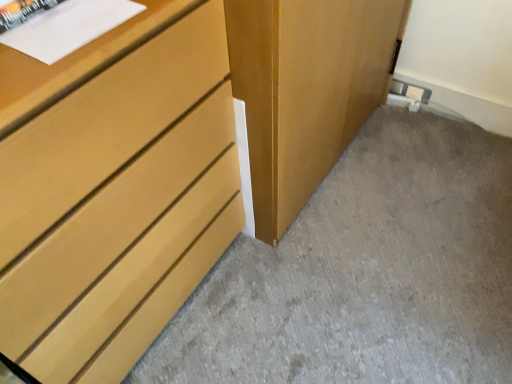
Consider the image. In order to face matte wood dresser at lower left, should I rotate leftwards or rightwards?

You should look right and rotate roughly 17.239 degrees.

Locate an element on the screen. matte wood dresser at lower left is located at coordinates (366, 273).

Describe the element at coordinates (366, 273) in the screenshot. This screenshot has height=384, width=512. I see `matte wood dresser at lower left` at that location.

This screenshot has height=384, width=512. Describe the element at coordinates (114, 194) in the screenshot. I see `matte wood chest of drawers at left` at that location.

This screenshot has width=512, height=384. I want to click on matte wood chest of drawers at left, so click(x=114, y=194).

The width and height of the screenshot is (512, 384). What are the coordinates of `matte wood dresser at lower left` in the screenshot? It's located at (366, 273).

Is matte wood dresser at lower left at the left side of matte wood chest of drawers at left?

In fact, matte wood dresser at lower left is to the right of matte wood chest of drawers at left.

Is matte wood dresser at lower left in front of or behind matte wood chest of drawers at left in the image?

Visually, matte wood dresser at lower left is located behind matte wood chest of drawers at left.

Is point (383, 169) positioned after point (101, 276)?

Yes, it is.

From the image's perspective, which one is positioned lower, matte wood dresser at lower left or matte wood chest of drawers at left?

matte wood dresser at lower left appears lower in the image.

From a real-world perspective, is matte wood dresser at lower left positioned under matte wood chest of drawers at left based on gravity?

Yes, from a real-world perspective, matte wood dresser at lower left is beneath matte wood chest of drawers at left.

Does matte wood dresser at lower left have a lesser width compared to matte wood chest of drawers at left?

Incorrect, the width of matte wood dresser at lower left is not less than that of matte wood chest of drawers at left.

Does matte wood dresser at lower left have a lesser height compared to matte wood chest of drawers at left?

Yes.

In terms of size, does matte wood dresser at lower left appear bigger or smaller than matte wood chest of drawers at left?

Clearly, matte wood dresser at lower left is smaller in size than matte wood chest of drawers at left.

Is matte wood dresser at lower left completely or partially outside of matte wood chest of drawers at left?

Yes.

Looking at this image, is matte wood dresser at lower left not close to matte wood chest of drawers at left?

matte wood dresser at lower left is near matte wood chest of drawers at left, not far away.

Could you tell me if matte wood dresser at lower left is facing matte wood chest of drawers at left?

No, matte wood dresser at lower left is not facing towards matte wood chest of drawers at left.

In the image, there is a matte wood dresser at lower left. At what (x,y) coordinates should I click in order to perform the action: click on the chest of drawers above it (from the image's perspective). Please return your answer as a coordinate pair (x, y). Image resolution: width=512 pixels, height=384 pixels. Looking at the image, I should click on (114, 194).

Which is more to the right, matte wood chest of drawers at left or matte wood dresser at lower left?

From the viewer's perspective, matte wood dresser at lower left appears more on the right side.

Which object is closer to the camera taking this photo, matte wood chest of drawers at left or matte wood dresser at lower left?

matte wood chest of drawers at left is closer to the camera.

Considering the points (41, 278) and (268, 270), which point is behind, point (41, 278) or point (268, 270)?

The point (268, 270) is farther from the camera.

From the image's perspective, which one is positioned lower, matte wood chest of drawers at left or matte wood dresser at lower left?

From the image's view, matte wood dresser at lower left is below.

From a real-world perspective, is matte wood chest of drawers at left above or below matte wood dresser at lower left?

Clearly, from a real-world perspective, matte wood chest of drawers at left is above matte wood dresser at lower left.

Considering the relative sizes of matte wood chest of drawers at left and matte wood dresser at lower left in the image provided, is matte wood chest of drawers at left wider than matte wood dresser at lower left?

In fact, matte wood chest of drawers at left might be narrower than matte wood dresser at lower left.

Is matte wood chest of drawers at left taller than matte wood dresser at lower left?

Yes.

Is matte wood chest of drawers at left bigger than matte wood dresser at lower left?

Yes.

Looking at this image, can matte wood dresser at lower left be found inside matte wood chest of drawers at left?

No, matte wood dresser at lower left is not surrounded by matte wood chest of drawers at left.

Is matte wood chest of drawers at left in contact with matte wood dresser at lower left?

No, matte wood chest of drawers at left is not making contact with matte wood dresser at lower left.

Could you tell me if matte wood chest of drawers at left is facing matte wood dresser at lower left?

No, matte wood chest of drawers at left is not oriented towards matte wood dresser at lower left.

The height and width of the screenshot is (384, 512). In order to click on concrete below the matte wood chest of drawers at left (from the image's perspective) in this screenshot , I will do `click(366, 273)`.

Locate an element on the screen. concrete below the matte wood chest of drawers at left (from a real-world perspective) is located at coordinates (366, 273).

Locate an element on the screen. The width and height of the screenshot is (512, 384). chest of drawers to the left of matte wood dresser at lower left is located at coordinates (x=114, y=194).